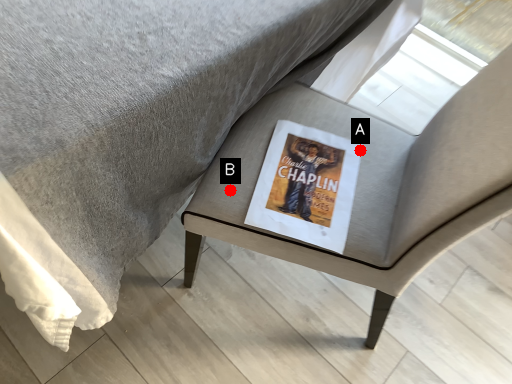
Question: Two points are circled on the image, labeled by A and B beside each circle. Which point appears farthest from the camera in this image?

Choices:
 (A) A is further
 (B) B is further

Answer: (A)